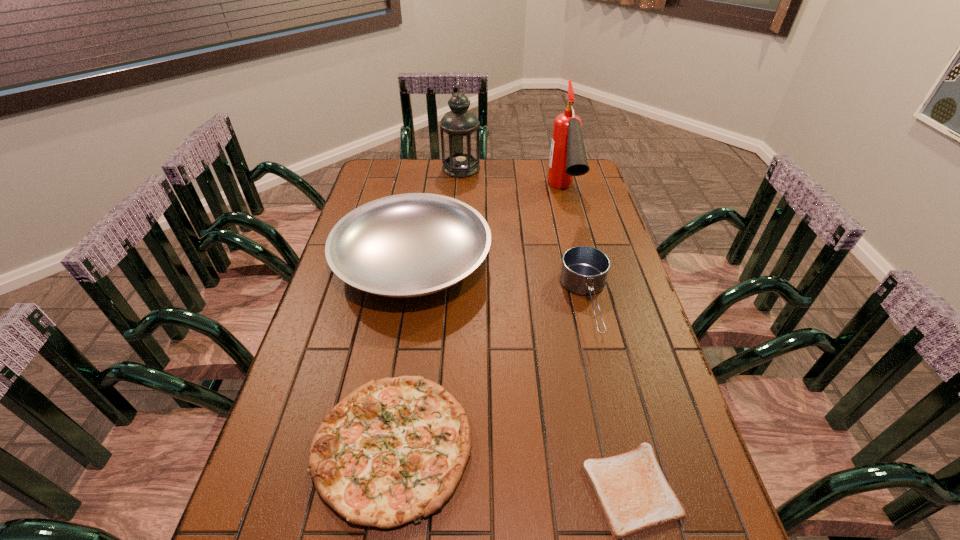
Locate an element on the screen. Image resolution: width=960 pixels, height=540 pixels. vacant region located 0.350m on the back of the second shortest object is located at coordinates (418, 282).

You are a GUI agent. You are given a task and a screenshot of the screen. Output one action in this format:
    pyautogui.click(x=<x>, y=<y>)
    Task: Click on the free space located on the left of the shortest object
    The height and width of the screenshot is (540, 960).
    Given the screenshot: What is the action you would take?
    pyautogui.click(x=433, y=489)

The image size is (960, 540). In order to click on oil lamp that is positioned at the far edge in this screenshot , I will do `click(460, 133)`.

Identify the location of fire extinguisher that is at the far edge. (568, 158).

Where is `bedpan located in the left edge section of the desktop`? This screenshot has width=960, height=540. bedpan located in the left edge section of the desktop is located at coordinates (409, 245).

The width and height of the screenshot is (960, 540). I want to click on pizza positioned at the left edge, so (x=393, y=451).

At what (x,y) coordinates should I click in order to perform the action: click on fire extinguisher that is at the right edge. Please return your answer as a coordinate pair (x, y). Looking at the image, I should click on (568, 158).

The image size is (960, 540). I want to click on saucepan positioned at the right edge, so click(584, 270).

Locate an element on the screen. toast situated at the right edge is located at coordinates (634, 495).

This screenshot has width=960, height=540. Identify the location of object present at the far right corner. (568, 158).